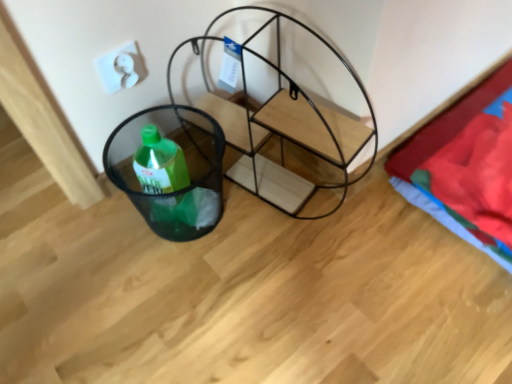
What is the approximate width of black wire shelving unit at center?

5.89 inches.

The width and height of the screenshot is (512, 384). In order to click on black wire shelving unit at center in this screenshot , I will do `click(288, 110)`.

Does black mesh basket at lower left turn towards red cotton blanket at right?

No.

Is black mesh basket at lower left at the left side of red cotton blanket at right?

Correct, you'll find black mesh basket at lower left to the left of red cotton blanket at right.

Can you confirm if black mesh basket at lower left is taller than red cotton blanket at right?

Yes, black mesh basket at lower left is taller than red cotton blanket at right.

How different are the orientations of white matte electric outlet at upper left and black wire shelving unit at center in degrees?

The angular difference between white matte electric outlet at upper left and black wire shelving unit at center is 77.1 degrees.

Can you confirm if white matte electric outlet at upper left is positioned to the left of black wire shelving unit at center?

Correct, you'll find white matte electric outlet at upper left to the left of black wire shelving unit at center.

Which is less distant, [138,53] or [265,23]?

The point [138,53] is in front.

Measure the distance between white matte electric outlet at upper left and black wire shelving unit at center.

white matte electric outlet at upper left is 12.41 inches away from black wire shelving unit at center.

From the picture: From a real-world perspective, which object stands above the other?

In real-world perspective, black wire shelving unit at center is above.

Is black mesh basket at lower left surrounding black wire shelving unit at center?

No, black wire shelving unit at center is not surrounded by black mesh basket at lower left.

Considering the positions of objects black mesh basket at lower left and black wire shelving unit at center in the image provided, who is in front, black mesh basket at lower left or black wire shelving unit at center?

black wire shelving unit at center is in front.

In terms of height, does black mesh basket at lower left look taller or shorter compared to black wire shelving unit at center?

Clearly, black mesh basket at lower left is shorter compared to black wire shelving unit at center.

How far apart are red cotton blanket at right and black mesh basket at lower left?

red cotton blanket at right and black mesh basket at lower left are 20.82 inches apart from each other.

Considering the sizes of objects red cotton blanket at right and black mesh basket at lower left in the image provided, who is thinner, red cotton blanket at right or black mesh basket at lower left?

With smaller width is black mesh basket at lower left.

Is red cotton blanket at right taller than black mesh basket at lower left?

Incorrect, the height of red cotton blanket at right is not larger of that of black mesh basket at lower left.

Which is behind, red cotton blanket at right or black mesh basket at lower left?

red cotton blanket at right is further from the camera.

From the image's perspective, is black wire shelving unit at center located beneath black mesh basket at lower left?

Actually, black wire shelving unit at center appears above black mesh basket at lower left in the image.

Do you think black wire shelving unit at center is within black mesh basket at lower left, or outside of it?

black wire shelving unit at center exists outside the volume of black mesh basket at lower left.

Is black wire shelving unit at center to the left or to the right of black mesh basket at lower left in the image?

Clearly, black wire shelving unit at center is on the right of black mesh basket at lower left in the image.

Is black wire shelving unit at center smaller than black mesh basket at lower left?

Actually, black wire shelving unit at center might be larger than black mesh basket at lower left.

Which is in front, point (99, 66) or point (139, 120)?

The point (99, 66) is closer to the camera.

In the scene shown: Is white matte electric outlet at upper left taller than black mesh basket at lower left?

No.

Considering the positions of objects white matte electric outlet at upper left and black mesh basket at lower left in the image provided, who is in front, white matte electric outlet at upper left or black mesh basket at lower left?

Positioned in front is black mesh basket at lower left.

Do you think white matte electric outlet at upper left is within black mesh basket at lower left, or outside of it?

white matte electric outlet at upper left is spatially situated outside black mesh basket at lower left.

Does point (457, 226) come farther from viewer compared to point (134, 57)?

Yes, point (457, 226) is behind point (134, 57).

Does red cotton blanket at right have a larger size compared to white matte electric outlet at upper left?

Yes, red cotton blanket at right is bigger than white matte electric outlet at upper left.

The width and height of the screenshot is (512, 384). Find the location of `electric outlet located in front of the red cotton blanket at right`. electric outlet located in front of the red cotton blanket at right is located at coordinates (120, 68).

What are the coordinates of `basket on the left of the red cotton blanket at right` in the screenshot? It's located at (170, 169).

The image size is (512, 384). What are the coordinates of `electric outlet located above the black wire shelving unit at center (from the image's perspective)` in the screenshot? It's located at (120, 68).

Looking at this image, considering their positions, is white matte electric outlet at upper left positioned closer to black wire shelving unit at center than black mesh basket at lower left?

black mesh basket at lower left lies closer to black wire shelving unit at center than the other object.

Looking at the image, which one is located further to black mesh basket at lower left, black wire shelving unit at center or white matte electric outlet at upper left?

Based on the image, white matte electric outlet at upper left appears to be further to black mesh basket at lower left.

Looking at this image, based on their spatial positions, is white matte electric outlet at upper left or black wire shelving unit at center further from black mesh basket at lower left?

Based on the image, white matte electric outlet at upper left appears to be further to black mesh basket at lower left.

Estimate the real-world distances between objects in this image. Which object is further from white matte electric outlet at upper left, black wire shelving unit at center or red cotton blanket at right?

red cotton blanket at right.

From the picture: Estimate the real-world distances between objects in this image. Which object is further from white matte electric outlet at upper left, red cotton blanket at right or black mesh basket at lower left?

red cotton blanket at right is further to white matte electric outlet at upper left.

Which object lies nearer to the anchor point white matte electric outlet at upper left, black mesh basket at lower left or black wire shelving unit at center?

Among the two, black mesh basket at lower left is located nearer to white matte electric outlet at upper left.

Considering their positions, is red cotton blanket at right positioned closer to black mesh basket at lower left than white matte electric outlet at upper left?

white matte electric outlet at upper left is positioned closer to the anchor black mesh basket at lower left.

From the image, which object appears to be nearer to white matte electric outlet at upper left, red cotton blanket at right or black wire shelving unit at center?

Among the two, black wire shelving unit at center is located nearer to white matte electric outlet at upper left.

Where is `furniture between white matte electric outlet at upper left and red cotton blanket at right in the horizontal direction`? The width and height of the screenshot is (512, 384). furniture between white matte electric outlet at upper left and red cotton blanket at right in the horizontal direction is located at coordinates (288, 110).

This screenshot has height=384, width=512. Identify the location of furniture between black mesh basket at lower left and red cotton blanket at right. (288, 110).

Locate an element on the screen. The width and height of the screenshot is (512, 384). basket situated between white matte electric outlet at upper left and red cotton blanket at right from left to right is located at coordinates (170, 169).

Identify the location of basket between white matte electric outlet at upper left and black wire shelving unit at center. (170, 169).